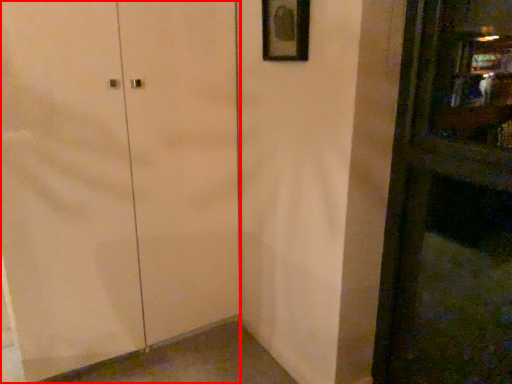
Question: From the image's perspective, where is door (annotated by the red box) located relative to picture frame?

Choices:
 (A) above
 (B) below

Answer: (B)